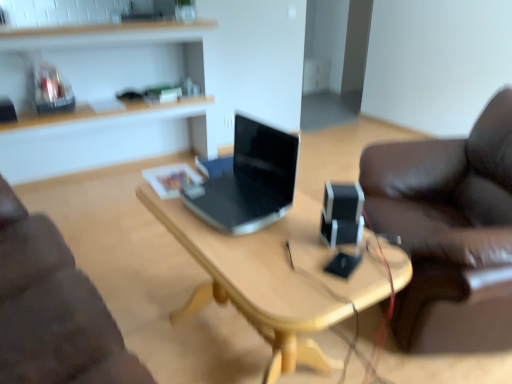
Question: Is wooden at upper left positioned beyond the bounds of wooden desk at center?

Choices:
 (A) yes
 (B) no

Answer: (A)

Question: Considering the relative sizes of wooden at upper left and wooden desk at center in the image provided, is wooden at upper left bigger than wooden desk at center?

Choices:
 (A) yes
 (B) no

Answer: (A)

Question: Is wooden at upper left touching wooden desk at center?

Choices:
 (A) no
 (B) yes

Answer: (A)

Question: From a real-world perspective, is wooden at upper left under wooden desk at center?

Choices:
 (A) yes
 (B) no

Answer: (B)

Question: Does wooden at upper left appear on the right side of wooden desk at center?

Choices:
 (A) no
 (B) yes

Answer: (A)

Question: Is wooden at upper left positioned with its back to wooden desk at center?

Choices:
 (A) yes
 (B) no

Answer: (B)

Question: From a real-world perspective, is black plastic speaker at center positioned under wooden desk at center based on gravity?

Choices:
 (A) no
 (B) yes

Answer: (A)

Question: Is black plastic speaker at center thinner than wooden desk at center?

Choices:
 (A) no
 (B) yes

Answer: (B)

Question: Considering the relative sizes of black plastic speaker at center and wooden desk at center in the image provided, is black plastic speaker at center wider than wooden desk at center?

Choices:
 (A) no
 (B) yes

Answer: (A)

Question: Can we say black plastic speaker at center lies outside wooden desk at center?

Choices:
 (A) yes
 (B) no

Answer: (A)

Question: Is black plastic speaker at center at the left side of wooden desk at center?

Choices:
 (A) yes
 (B) no

Answer: (B)

Question: Is black plastic speaker at center to the right of wooden desk at center from the viewer's perspective?

Choices:
 (A) no
 (B) yes

Answer: (B)

Question: Can you confirm if black plastic speaker at center is smaller than wooden at upper left?

Choices:
 (A) yes
 (B) no

Answer: (A)